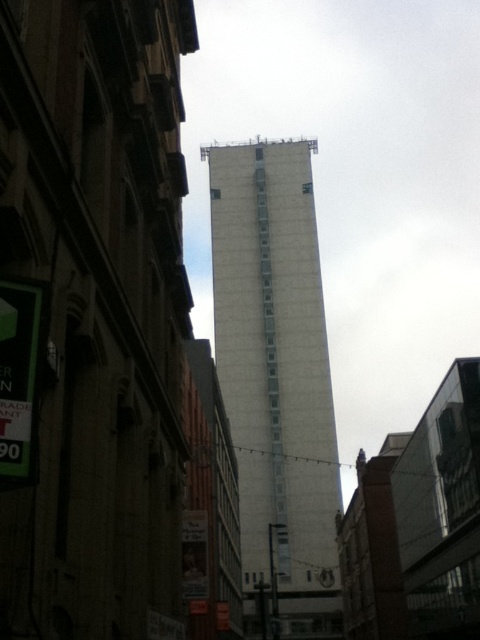
At what (x,y) coordinates should I click in order to perform the action: click on white concrete tower at center. Please return your answer as a coordinate pair (x, y). Looking at the image, I should click on (275, 360).

Does white concrete tower at center lie in front of green plastic sign at left?

That is False.

This screenshot has width=480, height=640. Find the location of `white concrete tower at center`. white concrete tower at center is located at coordinates (275, 360).